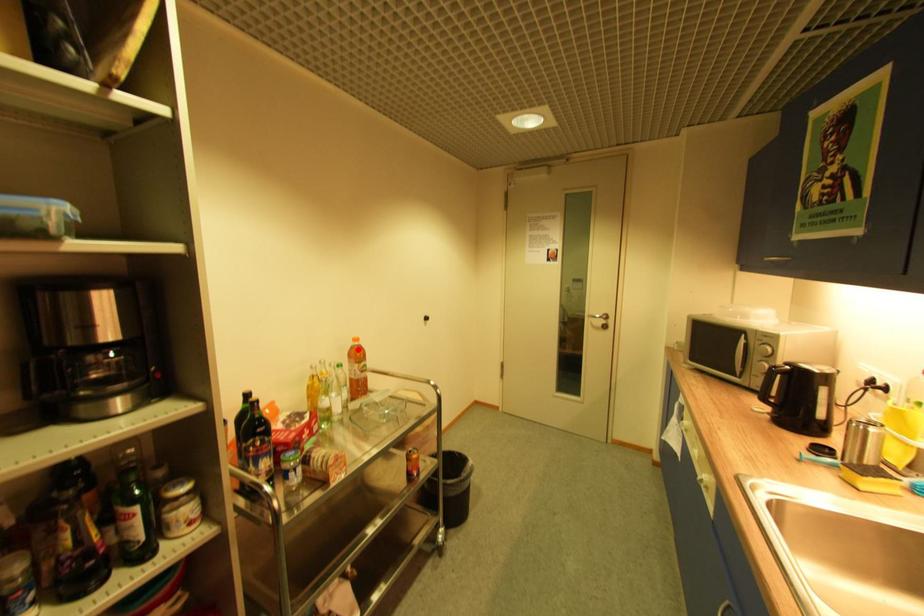
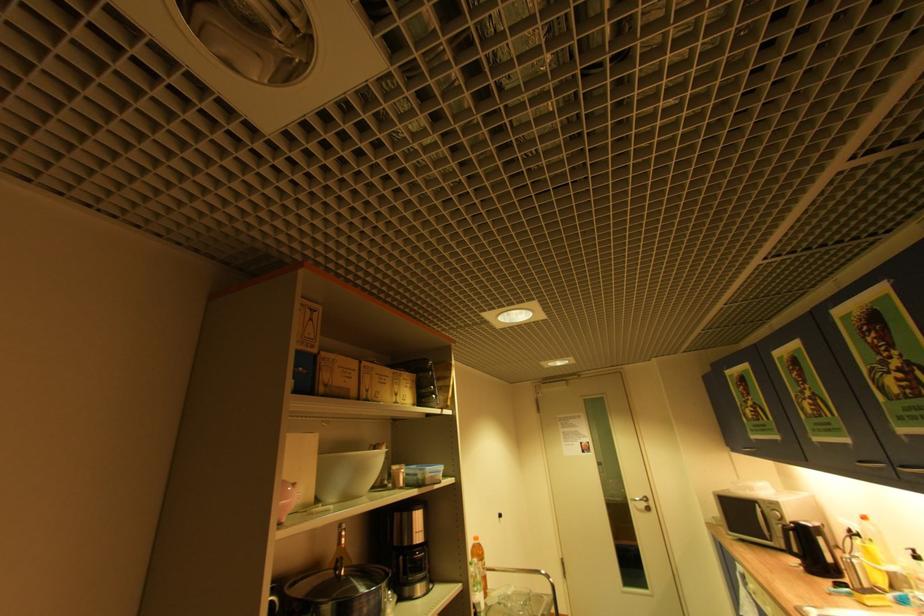
Where in the second image is the point corresponding to the highlighted location from the first image?

(480, 548)